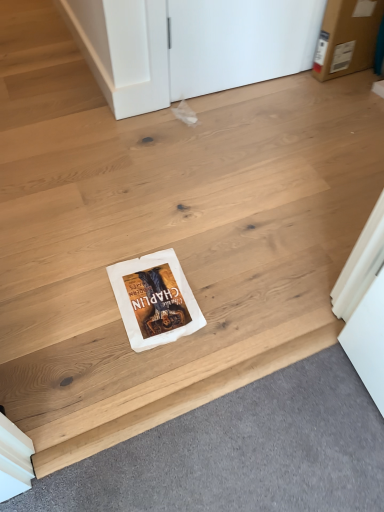
Describe the element at coordinates (241, 452) in the screenshot. This screenshot has width=384, height=512. I see `white matte book at center` at that location.

Measure the distance between point [145,460] and camera.

37.40 inches.

Image resolution: width=384 pixels, height=512 pixels. I want to click on white matte book at center, so click(241, 452).

Find the location of a particular element. white matte book at center is located at coordinates (241, 452).